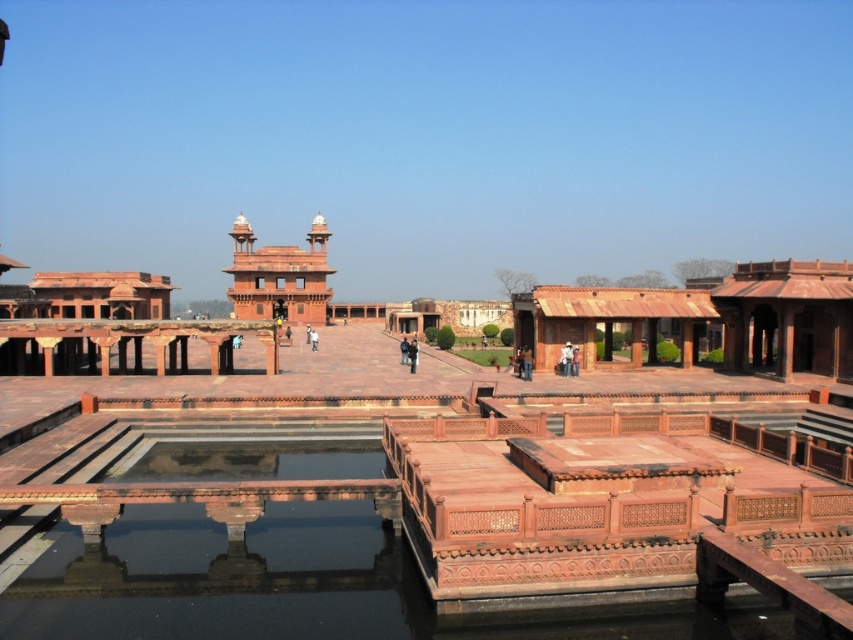
Is smooth stone water at center shorter than terracotta stone palace at center?

Yes, smooth stone water at center is shorter than terracotta stone palace at center.

The width and height of the screenshot is (853, 640). I want to click on smooth stone water at center, so click(x=515, y=525).